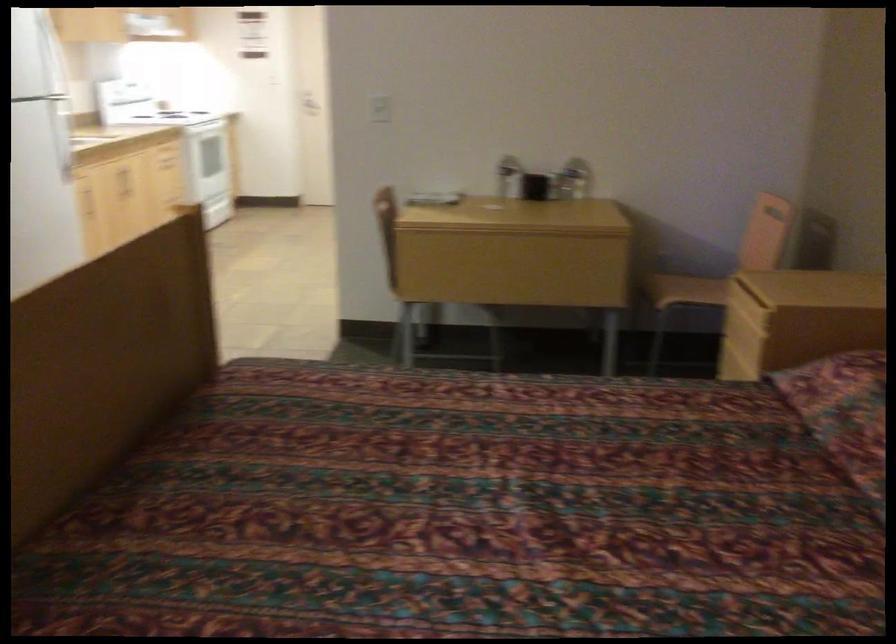
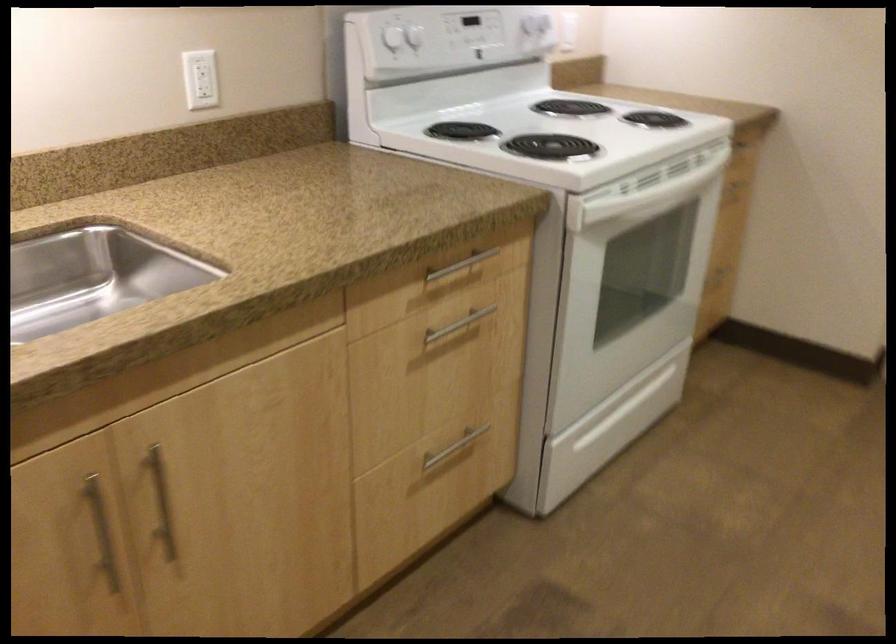
Locate, in the second image, the point that corresponds to point 128,175 in the first image.

(161, 502)